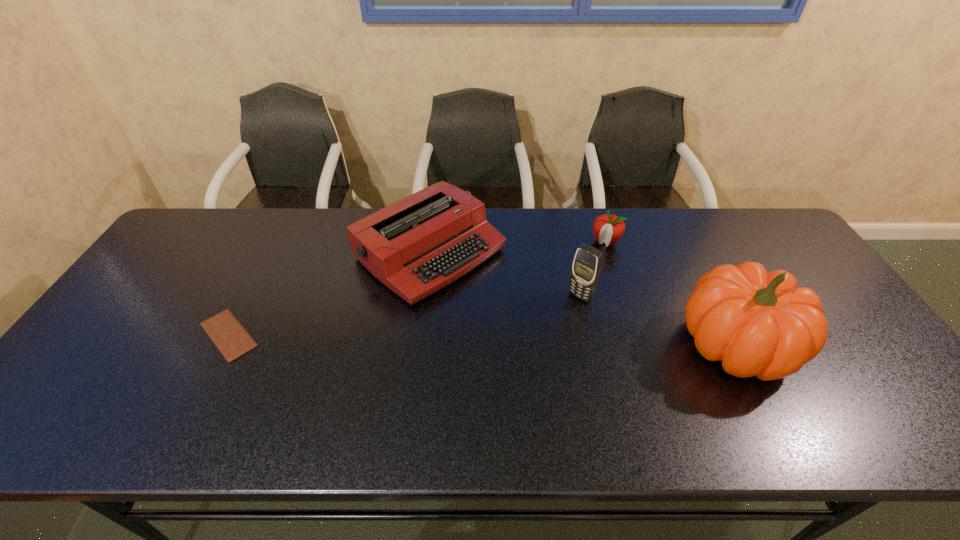
Where is `free space located on the side where a bite is taken out of the second object from right to left`? free space located on the side where a bite is taken out of the second object from right to left is located at coordinates (556, 319).

This screenshot has height=540, width=960. Identify the location of blank space located 0.140m on the side where a bite is taken out of the second object from right to left. (583, 277).

This screenshot has height=540, width=960. What are the coordinates of `free region located 0.400m on the side where a bite is taken out of the second object from right to left` in the screenshot? It's located at (544, 336).

The height and width of the screenshot is (540, 960). In order to click on free spot located on the typing side of the second object from left to right in this screenshot , I will do click(600, 381).

Identify the location of free point located on the typing side of the second object from left to right. click(x=545, y=339).

Where is `vacant space situated 0.380m on the typing side of the second object from left to right`? The width and height of the screenshot is (960, 540). vacant space situated 0.380m on the typing side of the second object from left to right is located at coordinates (593, 375).

You are a GUI agent. You are given a task and a screenshot of the screen. Output one action in this format:
    pyautogui.click(x=<x>, y=<y>)
    Task: Click on the vacant area situated 0.120m on the front face of the cellular telephone
    The width and height of the screenshot is (960, 540).
    Given the screenshot: What is the action you would take?
    pyautogui.click(x=549, y=328)

Where is `free location located on the front face of the cellular telephone`? This screenshot has height=540, width=960. free location located on the front face of the cellular telephone is located at coordinates (519, 359).

Locate an element on the screen. This screenshot has width=960, height=540. vacant space situated 0.350m on the front face of the cellular telephone is located at coordinates (493, 386).

Where is `apple located at the far edge`? The height and width of the screenshot is (540, 960). apple located at the far edge is located at coordinates (608, 228).